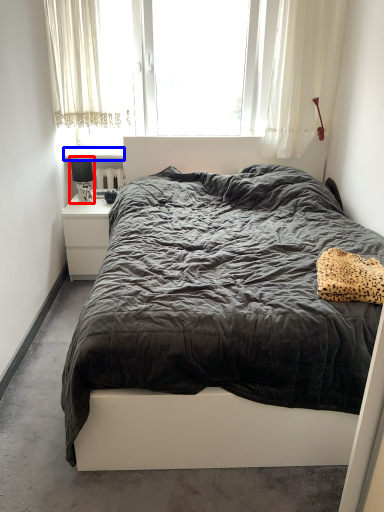
Question: Among these objects, which one is farthest to the camera, lamp (highlighted by a red box) or window sill (highlighted by a blue box)?

Choices:
 (A) lamp
 (B) window sill

Answer: (B)